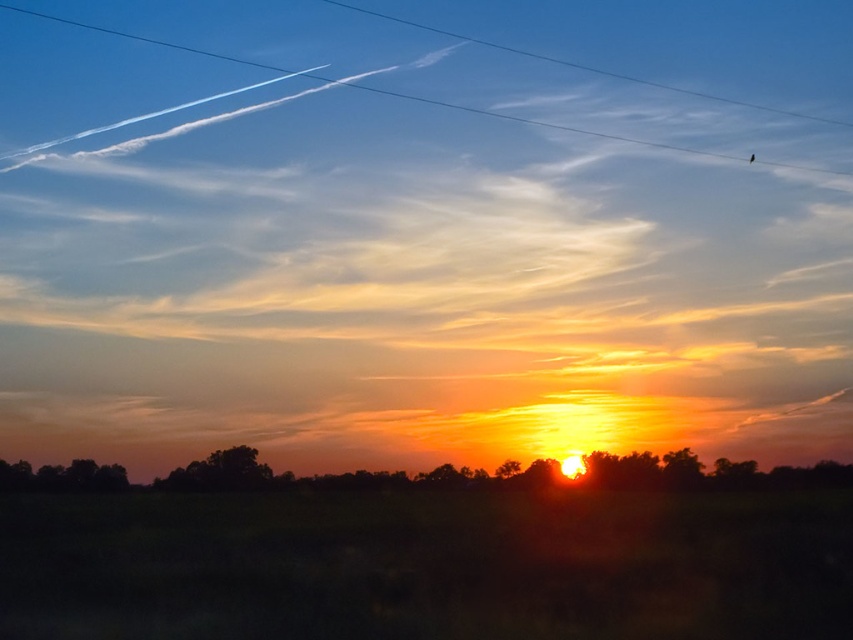
Between point (625, 484) and point (726, 157), which one is positioned behind?

Point (726, 157)

Is silhouetted trees at center wider than clear blue wire at upper center?

Incorrect, silhouetted trees at center's width does not surpass clear blue wire at upper center's.

Measure the distance between silhouetted trees at center and camera.

The distance of silhouetted trees at center from camera is 57.08 meters.

Identify the location of silhouetted trees at center. This screenshot has height=640, width=853. (341, 476).

Is green grass at lower center below silhouetted trees at center?

Incorrect, green grass at lower center is not positioned below silhouetted trees at center.

Is green grass at lower center smaller than silhouetted trees at center?

Indeed, green grass at lower center has a smaller size compared to silhouetted trees at center.

Is point (822, 561) more distant than point (589, 460)?

No, it is not.

This screenshot has width=853, height=640. Find the location of `green grass at lower center`. green grass at lower center is located at coordinates (426, 566).

Can you confirm if green grass at lower center is wider than clear blue wire at upper center?

No, green grass at lower center is not wider than clear blue wire at upper center.

Who is lower down, green grass at lower center or clear blue wire at upper center?

green grass at lower center is lower down.

The width and height of the screenshot is (853, 640). I want to click on green grass at lower center, so click(x=426, y=566).